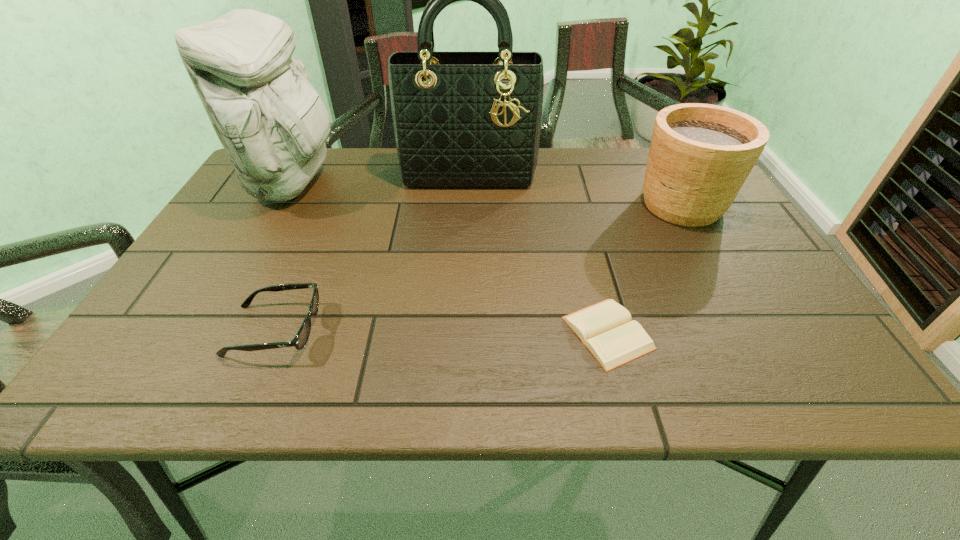
At what (x,y) coordinates should I click in order to perform the action: click on object that is at the far right corner. Please return your answer as a coordinate pair (x, y). Looking at the image, I should click on (700, 155).

Where is `vacant space at the far edge of the desktop`? vacant space at the far edge of the desktop is located at coordinates (314, 190).

Find the location of `vacant space at the near edge of the desktop`. vacant space at the near edge of the desktop is located at coordinates (444, 391).

In the image, there is a desktop. In order to click on vacant space at the left edge in this screenshot , I will do `click(197, 254)`.

What are the coordinates of `blank area at the right edge` in the screenshot? It's located at (794, 328).

The height and width of the screenshot is (540, 960). I want to click on empty space that is in between the handbag and the backpack, so click(381, 178).

I want to click on vacant area between the fourth object from left to right and the third object from right to left, so click(539, 253).

Where is `free space between the third tallest object and the shortest object`? free space between the third tallest object and the shortest object is located at coordinates (645, 268).

This screenshot has height=540, width=960. What are the coordinates of `free space between the flowerpot and the third object from left to right` in the screenshot? It's located at (575, 189).

Find the location of a particular element. vacant area that lies between the third object from right to left and the backpack is located at coordinates (381, 178).